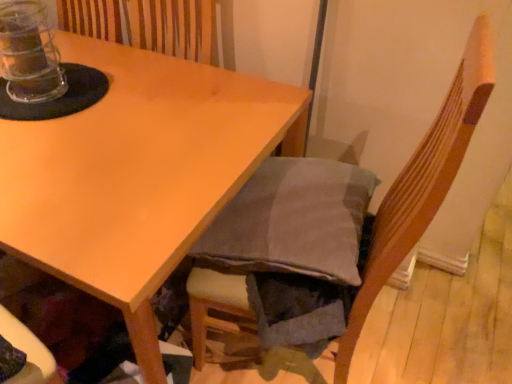
The image size is (512, 384). I want to click on vacant space to the right of transparent plastic jar at top left, so click(x=123, y=100).